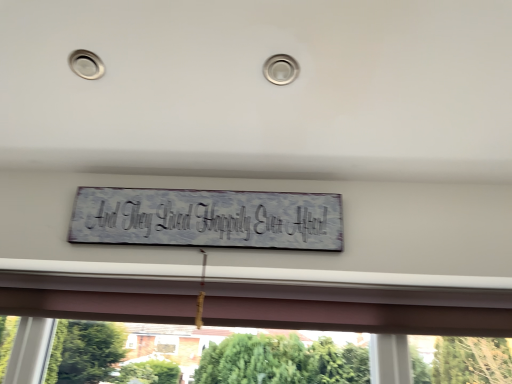
Question: From the image's perspective, is transparent glass window at center under white distressed wood sign at center?

Choices:
 (A) yes
 (B) no

Answer: (A)

Question: Is transparent glass window at center behind white distressed wood sign at center?

Choices:
 (A) yes
 (B) no

Answer: (A)

Question: Does transparent glass window at center appear on the right side of white distressed wood sign at center?

Choices:
 (A) no
 (B) yes

Answer: (B)

Question: From a real-world perspective, does transparent glass window at center stand above white distressed wood sign at center?

Choices:
 (A) yes
 (B) no

Answer: (B)

Question: Considering the relative positions of transparent glass window at center and white distressed wood sign at center in the image provided, is transparent glass window at center to the left of white distressed wood sign at center from the viewer's perspective?

Choices:
 (A) no
 (B) yes

Answer: (A)

Question: Is transparent glass window at center located outside white distressed wood sign at center?

Choices:
 (A) no
 (B) yes

Answer: (B)

Question: Is white distressed wood sign at center positioned beyond the bounds of transparent glass window at center?

Choices:
 (A) no
 (B) yes

Answer: (B)

Question: Does white distressed wood sign at center touch transparent glass window at center?

Choices:
 (A) no
 (B) yes

Answer: (A)

Question: Is white distressed wood sign at center taller than transparent glass window at center?

Choices:
 (A) yes
 (B) no

Answer: (B)

Question: Does white distressed wood sign at center have a lesser width compared to transparent glass window at center?

Choices:
 (A) yes
 (B) no

Answer: (A)

Question: Is white distressed wood sign at center positioned behind transparent glass window at center?

Choices:
 (A) no
 (B) yes

Answer: (A)

Question: Could you tell me if white distressed wood sign at center is turned towards transparent glass window at center?

Choices:
 (A) yes
 (B) no

Answer: (B)

Question: Relative to white distressed wood sign at center, is transparent glass window at center in front or behind?

Choices:
 (A) front
 (B) behind

Answer: (B)